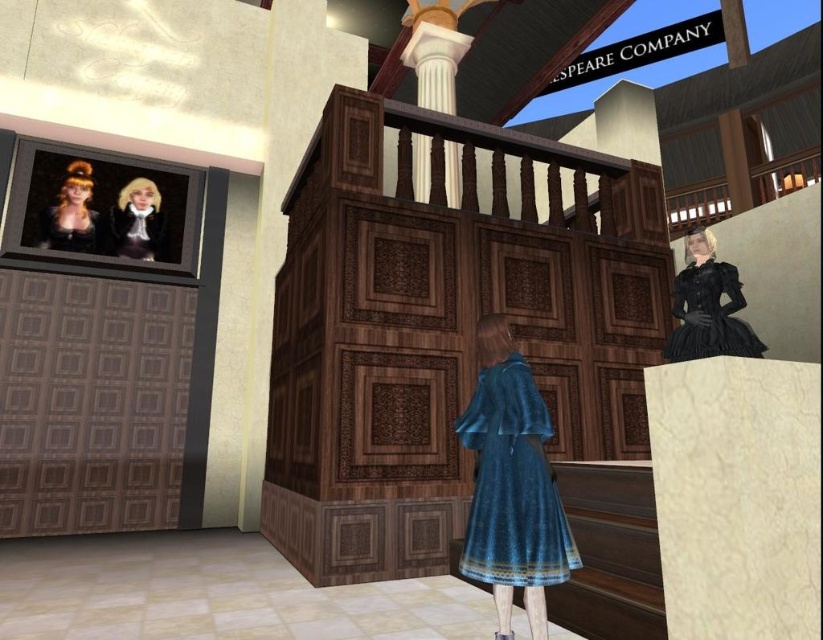
You are an event planner arranging a photoshoot in this theater scene. You need to position a camera to capture both the black satin dress at upper right and the matte black hair at upper left. Based on their positions, which object should you focus on first to ensure both are in frame?

The black satin dress at upper right is located below the matte black hair at upper left. To ensure both are in frame, focus on the matte black hair at upper left first as it is higher up, then adjust the camera angle downward to include the black satin dress at upper right.

You are a photographer setting up for a photoshoot in this theater scene. You need to ensure that the black satin dress at upper right and the matte black hair at upper left are both visible in your shot. Given their sizes, which object should you focus on first to frame the composition properly?

The black satin dress at upper right is bigger than the matte black hair at upper left, so you should focus on framing the larger object first, which is the black satin dress at upper right, to ensure it fits well within the frame before adjusting for the smaller matte black hair at upper left.